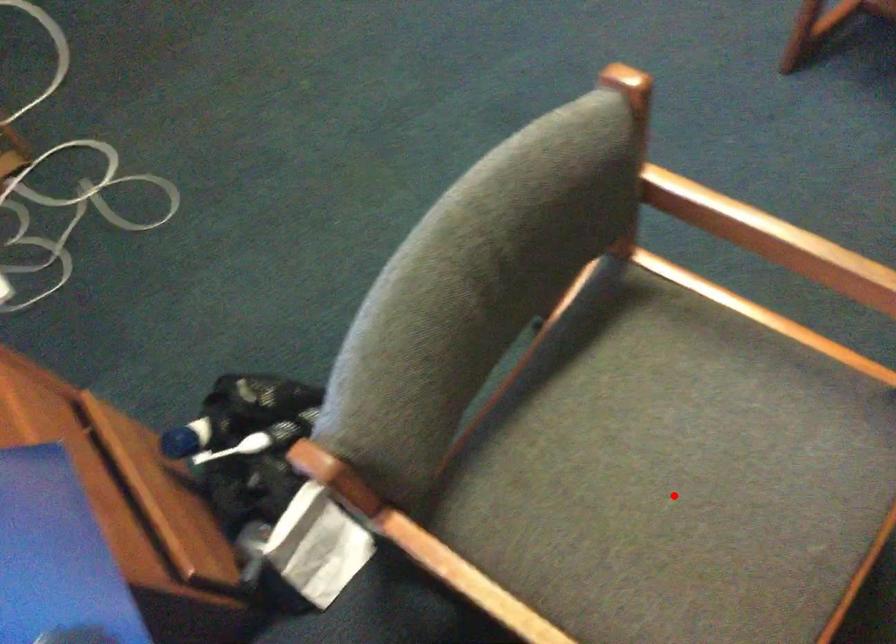
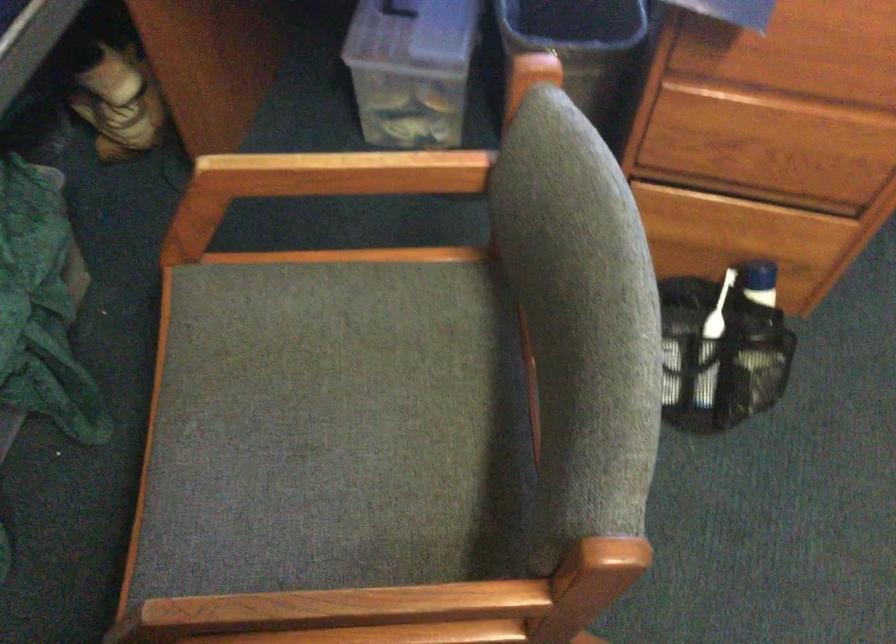
Locate, in the second image, the point that corresponds to the highlighted location in the first image.

(347, 406)